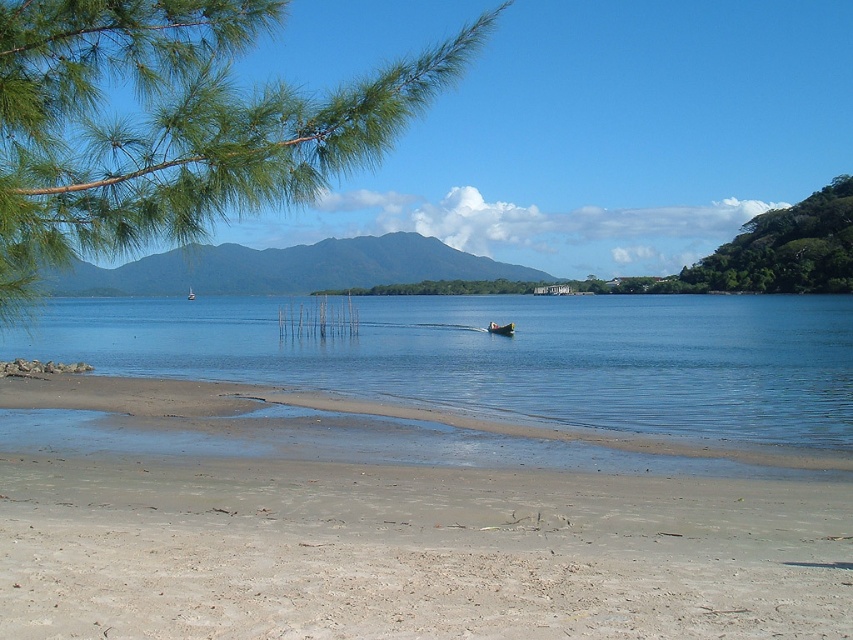
Between sandy at lower left and clear blue water at center, which one appears on the right side from the viewer's perspective?

sandy at lower left is more to the right.

Does sandy at lower left have a larger size compared to clear blue water at center?

Incorrect, sandy at lower left is not larger than clear blue water at center.

Describe the element at coordinates (412, 552) in the screenshot. I see `sandy at lower left` at that location.

Identify the location of sandy at lower left. The width and height of the screenshot is (853, 640). (412, 552).

Does sandy at lower left have a smaller size compared to white plastic boat at center?

Correct, sandy at lower left occupies less space than white plastic boat at center.

Locate an element on the screen. Image resolution: width=853 pixels, height=640 pixels. sandy at lower left is located at coordinates (412, 552).

The width and height of the screenshot is (853, 640). What are the coordinates of `sandy at lower left` in the screenshot? It's located at [412, 552].

Can you confirm if sandy at lower left is bigger than green leafy branch at upper left?

No.

You are a GUI agent. You are given a task and a screenshot of the screen. Output one action in this format:
    pyautogui.click(x=<x>, y=<y>)
    Task: Click on the sandy at lower left
    The height and width of the screenshot is (640, 853).
    Given the screenshot: What is the action you would take?
    pyautogui.click(x=412, y=552)

This screenshot has height=640, width=853. What do you see at coordinates (412, 552) in the screenshot? I see `sandy at lower left` at bounding box center [412, 552].

Where is `sandy at lower left`? The width and height of the screenshot is (853, 640). sandy at lower left is located at coordinates (412, 552).